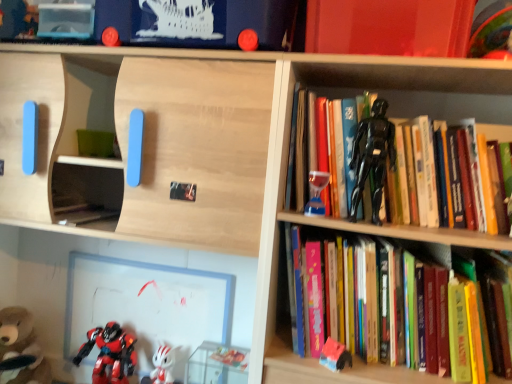
The image size is (512, 384). Identify the location of white glossy figurine at lower center, acting as the fourth toy starting from the right. (161, 366).

Based on the photo, how much space does smooth plastic toys at lower left, positioned as the second shelf in front-to-back order, occupy horizontally?

The width of smooth plastic toys at lower left, positioned as the second shelf in front-to-back order, is 0.96 inches.

This screenshot has width=512, height=384. Describe the element at coordinates (110, 354) in the screenshot. I see `shiny red plastic robot at lower left, which ranks as the 2th toy in left-to-right order` at that location.

This screenshot has height=384, width=512. Describe the element at coordinates (335, 355) in the screenshot. I see `rubberized plastic toy at lower right, the 5th toy when ordered from left to right` at that location.

Locate an element on the screen. rubberized plastic toy at lower right, which ranks as the second toy in right-to-left order is located at coordinates (335, 355).

Where is `translucent glass hourglass at upper right, marked as the fourth toy in a left-to-right arrangement`? translucent glass hourglass at upper right, marked as the fourth toy in a left-to-right arrangement is located at coordinates (316, 193).

What is the approximate height of wooden shelf at upper center, which is counted as the first shelf, starting from the front?

The height of wooden shelf at upper center, which is counted as the first shelf, starting from the front, is 3.98 feet.

The height and width of the screenshot is (384, 512). I want to click on white glossy figurine at lower center, the 3th toy from the left, so click(161, 366).

Does black plastic action figure at upper right have a larger size compared to hardcover book at upper right, the second book viewed from the top?

Yes.

From a real-world perspective, which object rests below the other?

From a 3D spatial view, hardcover book at upper right, the second book viewed from the top, is below.

Are black plastic action figure at upper right and hardcover book at upper right, the second book viewed from the top, making contact?

No, black plastic action figure at upper right is not touching hardcover book at upper right, the second book viewed from the top.

Considering the relative positions of black plastic action figure at upper right and hardcover book at upper right, arranged as the 1th book when ordered from the bottom, in the image provided, is black plastic action figure at upper right in front of hardcover book at upper right, arranged as the 1th book when ordered from the bottom,?

Yes, it is.

This screenshot has width=512, height=384. In order to click on the 3rd toy in front of the shiny red plastic robot at lower left, which ranks as the 2th toy in left-to-right order, starting your count from the anchor in this screenshot , I will do `click(335, 355)`.

Can we say shiny red plastic robot at lower left, which appears as the fifth toy when viewed from the right, lies outside rubberized plastic toy at lower right, which ranks as the second toy in right-to-left order?

Yes, shiny red plastic robot at lower left, which appears as the fifth toy when viewed from the right, is not within rubberized plastic toy at lower right, which ranks as the second toy in right-to-left order.

From the picture: From a real-world perspective, which is physically above, shiny red plastic robot at lower left, which ranks as the 2th toy in left-to-right order, or rubberized plastic toy at lower right, which ranks as the second toy in right-to-left order?

rubberized plastic toy at lower right, which ranks as the second toy in right-to-left order, is physically above.

You are a GUI agent. You are given a task and a screenshot of the screen. Output one action in this format:
    pyautogui.click(x=<x>, y=<y>)
    Task: Click on the bookcase below the wooden shelf at upper center, positioned as the 2th shelf in back-to-front order (from the image's perspective)
    The image size is (512, 384).
    Given the screenshot: What is the action you would take?
    pyautogui.click(x=285, y=165)

Would you say black plastic action figure at upper right is outside wooden shelf at upper center, which is counted as the first shelf, starting from the front?

That's correct, black plastic action figure at upper right is outside of wooden shelf at upper center, which is counted as the first shelf, starting from the front.

From a real-world perspective, is black plastic action figure at upper right above or below wooden shelf at upper center, which is counted as the first shelf, starting from the front?

Clearly, from a real-world perspective, black plastic action figure at upper right is above wooden shelf at upper center, which is counted as the first shelf, starting from the front.

Would you consider black plastic action figure at upper right to be distant from wooden shelf at upper center, positioned as the 2th shelf in back-to-front order?

No, black plastic action figure at upper right is in close proximity to wooden shelf at upper center, positioned as the 2th shelf in back-to-front order.

Considering the positions of objects white glossy figurine at lower center, the 3th toy from the left, and smooth plastic toys at lower left, positioned as the second shelf in front-to-back order, in the image provided, who is more to the left, white glossy figurine at lower center, the 3th toy from the left, or smooth plastic toys at lower left, positioned as the second shelf in front-to-back order,?

smooth plastic toys at lower left, positioned as the second shelf in front-to-back order.

Based on their sizes in the image, would you say white glossy figurine at lower center, the 3th toy from the left, is bigger or smaller than smooth plastic toys at lower left, positioned as the second shelf in front-to-back order?

In the image, white glossy figurine at lower center, the 3th toy from the left, appears to be smaller than smooth plastic toys at lower left, positioned as the second shelf in front-to-back order.

Is point (170, 381) closer or farther from the camera than point (18, 290)?

Point (170, 381) is positioned closer to the camera compared to point (18, 290).

Is shiny red plastic robot at lower left, which ranks as the 2th toy in left-to-right order, in front of or behind smooth plastic toys at lower left, positioned as the second shelf in front-to-back order, in the image?

shiny red plastic robot at lower left, which ranks as the 2th toy in left-to-right order, is positioned closer to the viewer than smooth plastic toys at lower left, positioned as the second shelf in front-to-back order.

Can you tell me how much shiny red plastic robot at lower left, which appears as the fifth toy when viewed from the right, and smooth plastic toys at lower left, which is counted as the 1th shelf, starting from the back, differ in facing direction?

There is a 2.82-degree angle between the facing directions of shiny red plastic robot at lower left, which appears as the fifth toy when viewed from the right, and smooth plastic toys at lower left, which is counted as the 1th shelf, starting from the back.

Is shiny red plastic robot at lower left, which appears as the fifth toy when viewed from the right, positioned with its back to smooth plastic toys at lower left, which is counted as the 1th shelf, starting from the back?

Absolutely, shiny red plastic robot at lower left, which appears as the fifth toy when viewed from the right, is directed away from smooth plastic toys at lower left, which is counted as the 1th shelf, starting from the back.

Based on their positions, is shiny red plastic robot at lower left, which ranks as the 2th toy in left-to-right order, located to the left or right of smooth plastic toys at lower left, which is counted as the 1th shelf, starting from the back?

shiny red plastic robot at lower left, which ranks as the 2th toy in left-to-right order, is to the left of smooth plastic toys at lower left, which is counted as the 1th shelf, starting from the back.

Measure the distance from smooth plastic toys at lower left, positioned as the second shelf in front-to-back order, to wooden shelf at upper center, which is counted as the first shelf, starting from the front.

15.41 inches.

In the scene shown: Which object is positioned more to the left, smooth plastic toys at lower left, which is counted as the 1th shelf, starting from the back, or wooden shelf at upper center, which is counted as the first shelf, starting from the front?

wooden shelf at upper center, which is counted as the first shelf, starting from the front, is more to the left.

Does smooth plastic toys at lower left, which is counted as the 1th shelf, starting from the back, turn towards wooden shelf at upper center, which is counted as the first shelf, starting from the front?

Yes, smooth plastic toys at lower left, which is counted as the 1th shelf, starting from the back, is facing wooden shelf at upper center, which is counted as the first shelf, starting from the front.

How many degrees apart are the facing directions of hardcover book at upper right, the second book viewed from the top, and translucent glass hourglass at upper right, positioned as the 3th toy in right-to-left order?

hardcover book at upper right, the second book viewed from the top, and translucent glass hourglass at upper right, positioned as the 3th toy in right-to-left order, are facing 2.7 degrees away from each other.

Where is `the 1st book to the right when counting from the translucent glass hourglass at upper right, positioned as the 3th toy in right-to-left order`? the 1st book to the right when counting from the translucent glass hourglass at upper right, positioned as the 3th toy in right-to-left order is located at coordinates (394, 306).

Can you confirm if hardcover book at upper right, the second book viewed from the top, is wider than translucent glass hourglass at upper right, marked as the fourth toy in a left-to-right arrangement?

Yes, hardcover book at upper right, the second book viewed from the top, is wider than translucent glass hourglass at upper right, marked as the fourth toy in a left-to-right arrangement.

Is hardcover book at upper right, the second book viewed from the top, bigger than translucent glass hourglass at upper right, positioned as the 3th toy in right-to-left order?

Yes, hardcover book at upper right, the second book viewed from the top, is bigger than translucent glass hourglass at upper right, positioned as the 3th toy in right-to-left order.

This screenshot has width=512, height=384. In order to click on bookcase that is in front of the hardcover book at upper right, arranged as the 1th book when ordered from the bottom in this screenshot , I will do `click(285, 165)`.

The height and width of the screenshot is (384, 512). What are the coordinates of `the 3rd toy positioned below the rubberized plastic toy at lower right, which ranks as the second toy in right-to-left order (from the image's perspective)` in the screenshot? It's located at (110, 354).

In the scene shown: Looking at the image, which one is located closer to black plastic action figure at upper right, brown plush bear at lower left, marked as the sixth toy in a right-to-left arrangement, or hardcover book at upper right, arranged as the 1th book when ordered from the bottom?

hardcover book at upper right, arranged as the 1th book when ordered from the bottom.

Which object lies further to the anchor point white glossy figurine at lower center, acting as the fourth toy starting from the right, black glossy action figure at upper right, the sixth toy in the left-to-right sequence, or rubberized plastic toy at lower right, which ranks as the second toy in right-to-left order?

black glossy action figure at upper right, the sixth toy in the left-to-right sequence.

Looking at the image, which one is located further to translucent glass hourglass at upper right, positioned as the 3th toy in right-to-left order, wooden shelf at upper center, which is counted as the first shelf, starting from the front, or brown plush bear at lower left, marked as the sixth toy in a right-to-left arrangement?

Among the two, brown plush bear at lower left, marked as the sixth toy in a right-to-left arrangement, is located further to translucent glass hourglass at upper right, positioned as the 3th toy in right-to-left order.

When comparing their distances from rubberized plastic toy at lower right, which ranks as the second toy in right-to-left order, does brown plush bear at lower left, marked as the sixth toy in a right-to-left arrangement, or black plastic action figure at upper right seem closer?

black plastic action figure at upper right.

Considering their positions, is wooden shelf at upper center, positioned as the 2th shelf in back-to-front order, positioned further to white glossy figurine at lower center, the 3th toy from the left, than shiny red plastic robot at lower left, which ranks as the 2th toy in left-to-right order?

Among the two, wooden shelf at upper center, positioned as the 2th shelf in back-to-front order, is located further to white glossy figurine at lower center, the 3th toy from the left.

When comparing their distances from hardcover book at upper right, the second book viewed from the top, does brown plush bear at lower left, which appears as the 1th toy when viewed from the left, or smooth plastic toys at lower left, which is counted as the 1th shelf, starting from the back, seem further?

Among the two, brown plush bear at lower left, which appears as the 1th toy when viewed from the left, is located further to hardcover book at upper right, the second book viewed from the top.

Estimate the real-world distances between objects in this image. Which object is further from black plastic action figure at upper right, black glossy action figure at upper right, which is the 1th book in top-to-bottom order, or wooden shelf at upper center, positioned as the 2th shelf in back-to-front order?

Based on the image, wooden shelf at upper center, positioned as the 2th shelf in back-to-front order, appears to be further to black plastic action figure at upper right.

From the image, which object appears to be nearer to hardcover book at upper right, arranged as the 1th book when ordered from the bottom, shiny red plastic robot at lower left, which appears as the fifth toy when viewed from the right, or rubberized plastic toy at lower right, which ranks as the second toy in right-to-left order?

Among the two, rubberized plastic toy at lower right, which ranks as the second toy in right-to-left order, is located nearer to hardcover book at upper right, arranged as the 1th book when ordered from the bottom.

Find the location of a particular element. This screenshot has width=512, height=384. book situated between wooden shelf at upper center, positioned as the 2th shelf in back-to-front order, and black glossy action figure at upper right, which is the 1th book in top-to-bottom order, from left to right is located at coordinates (394, 306).

The image size is (512, 384). In order to click on shelf between wooden shelf at upper center, which is counted as the first shelf, starting from the front, and black glossy action figure at upper right, the sixth toy in the left-to-right sequence, from left to right in this screenshot , I will do `click(101, 254)`.

Where is `shelf located between wooden shelf at upper center, positioned as the 2th shelf in back-to-front order, and black plastic action figure at upper right in the left-right direction`? The image size is (512, 384). shelf located between wooden shelf at upper center, positioned as the 2th shelf in back-to-front order, and black plastic action figure at upper right in the left-right direction is located at coordinates (101, 254).

Locate an element on the screen. toy between black glossy action figure at upper right, the 1th toy viewed from the right, and black plastic action figure at upper right vertically is located at coordinates (316, 193).